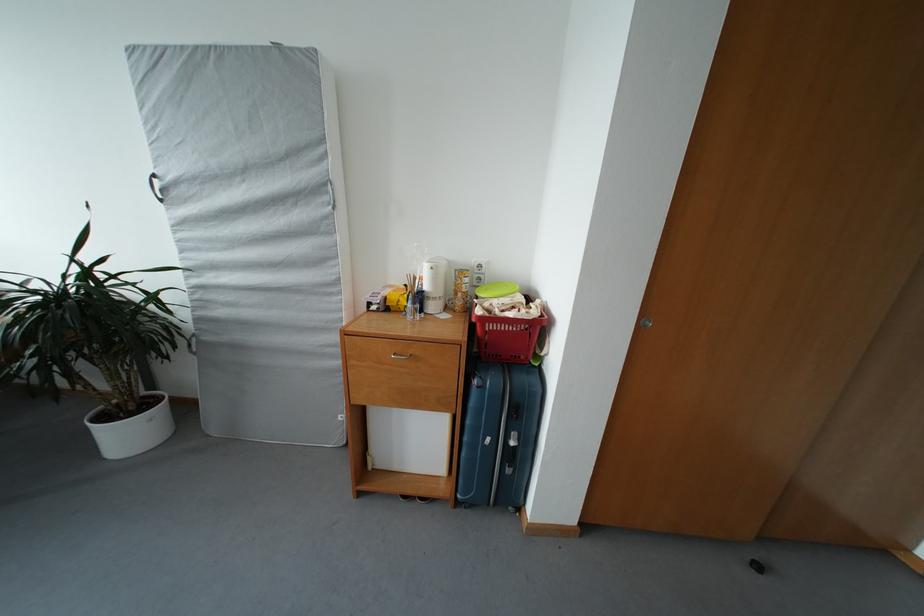
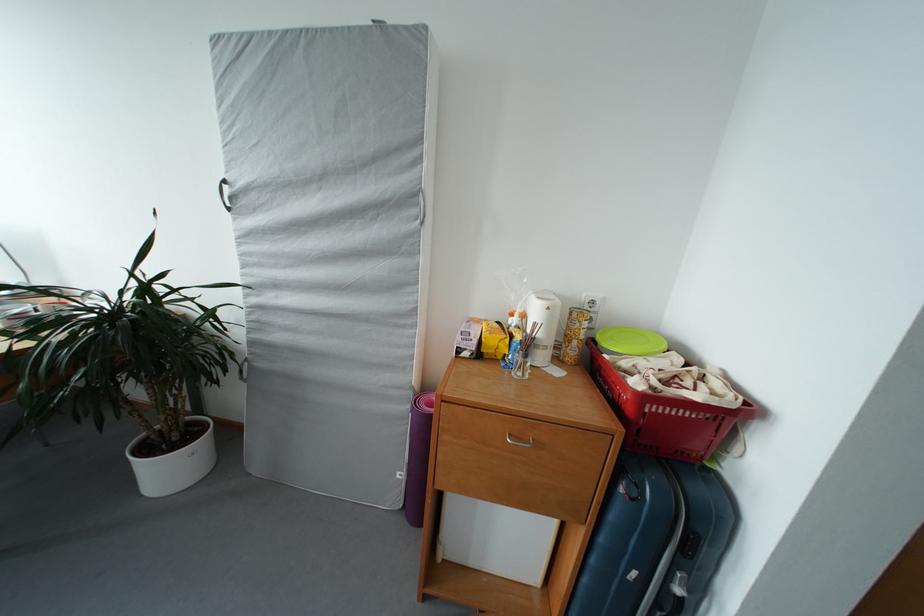
Based on the photo, the images are taken continuously from a first-person perspective. In which direction are you moving?

The movement direction of the cameraman is left, forward.